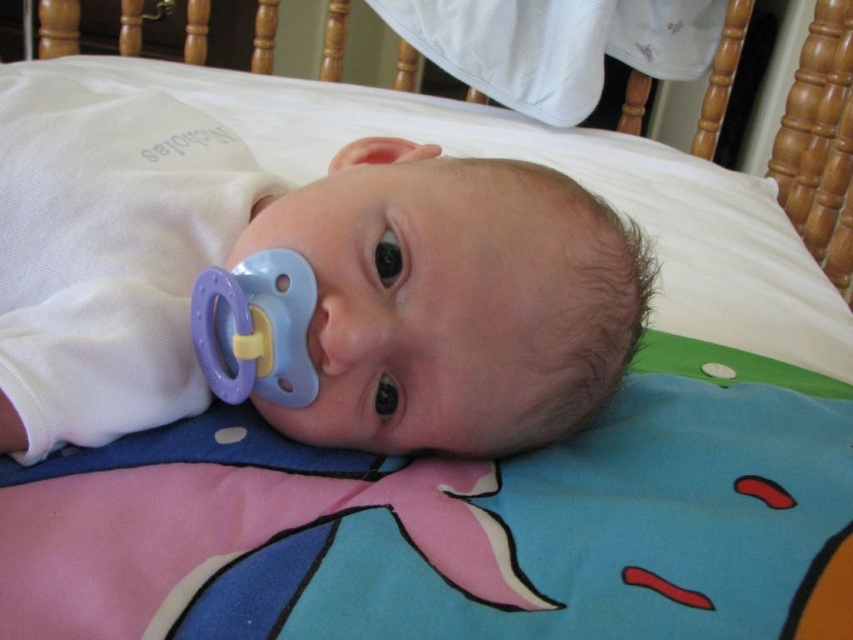
Question: Which of the following is the closest to the observer?

Choices:
 (A) white soft baby at center
 (B) purple plastic pacifier at center

Answer: (A)

Question: Is white soft baby at center to the right of purple plastic pacifier at center from the viewer's perspective?

Choices:
 (A) no
 (B) yes

Answer: (A)

Question: From the image, what is the correct spatial relationship of white soft baby at center in relation to purple plastic pacifier at center?

Choices:
 (A) left
 (B) right

Answer: (A)

Question: Which point is closer to the camera taking this photo?

Choices:
 (A) (201, 371)
 (B) (45, 179)

Answer: (A)

Question: Does white soft baby at center have a smaller size compared to purple plastic pacifier at center?

Choices:
 (A) yes
 (B) no

Answer: (B)

Question: Among these points, which one is nearest to the camera?

Choices:
 (A) (344, 228)
 (B) (302, 404)

Answer: (A)